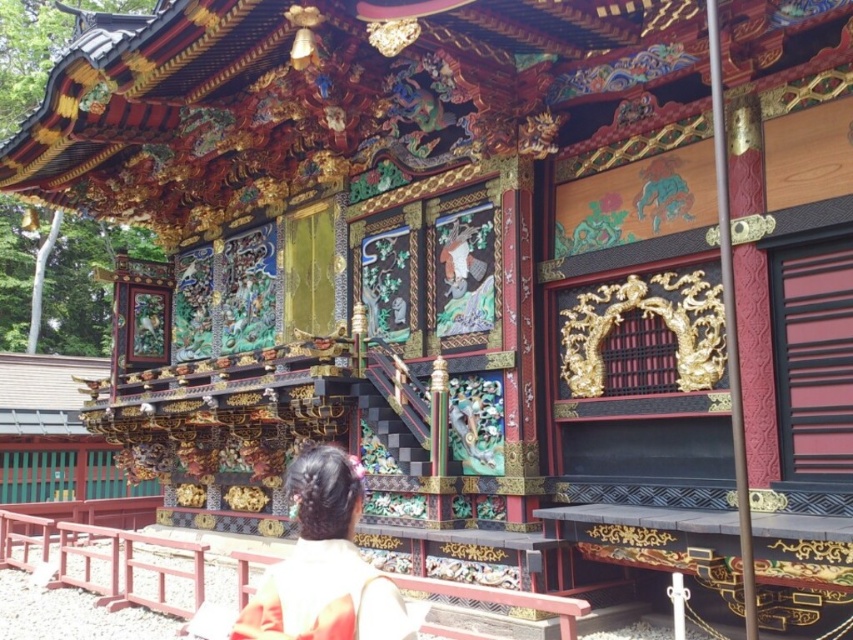
You are visiting the shrine and want to sit down on the wooden bench at lower center. Where should you go relative to the silk kimono at center?

The wooden bench at lower center is to the left of the silk kimono at center, so you should go to the left side of the silk kimono at center to reach it.

You are a visitor at the shrine and want to place a 7.5 meter long scroll between the wooden bench at lower center and the silk kimono at center. Is the space between them long enough to accommodate the scroll without folding it?

The distance between the wooden bench at lower center and the silk kimono at center is 6.91 meters. Since the scroll is 7.5 meters long, it is longer than the available space. Therefore, the scroll cannot be placed between them without folding.